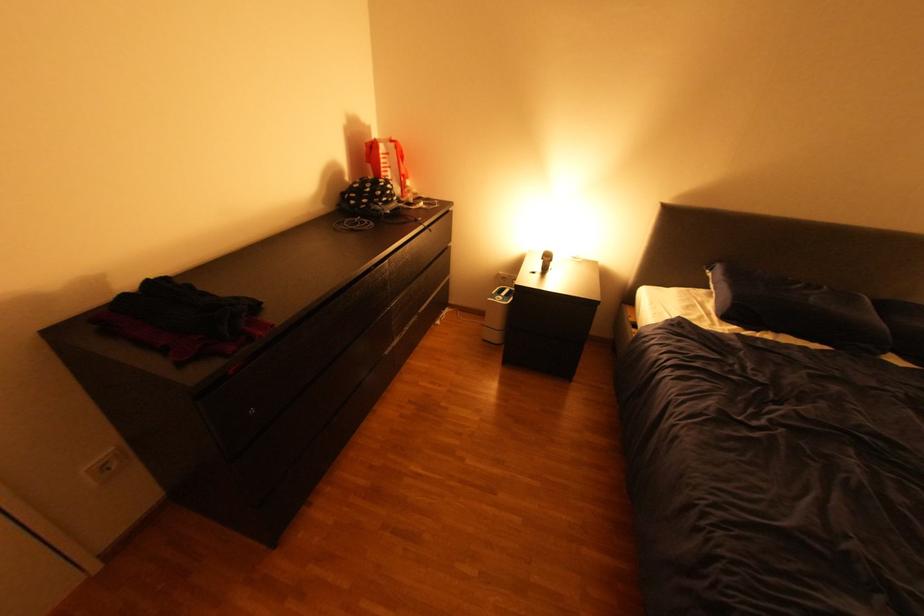
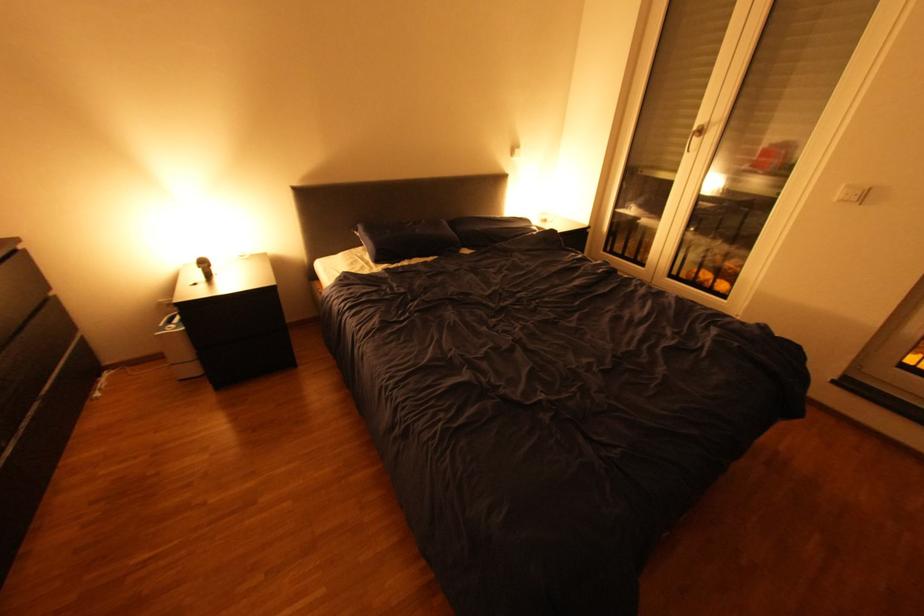
Question: Based on the continuous images, in which direction is the camera rotating? Reply with the corresponding letter.

Choices:
 (A) Left
 (B) Right
 (C) Up
 (D) Down

Answer: (B)